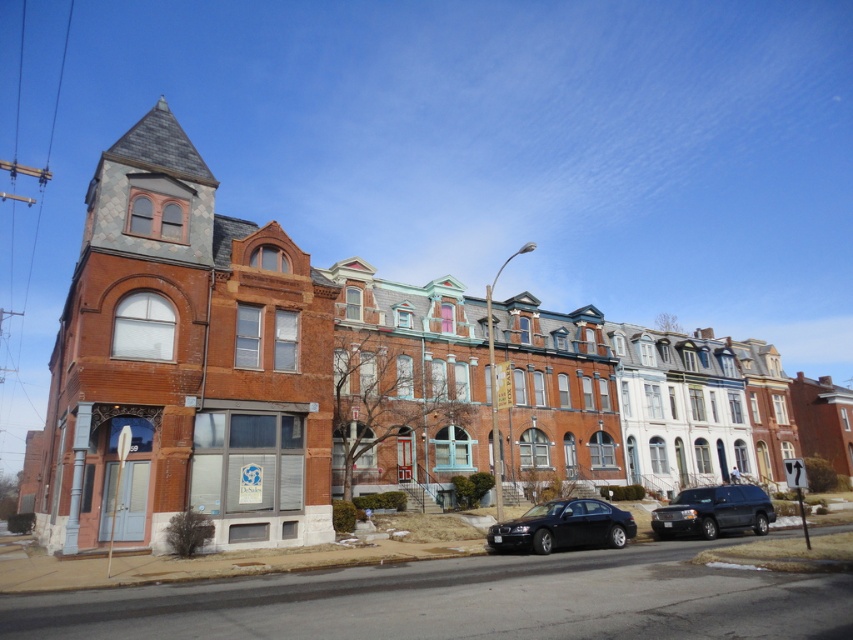
Question: Is shiny black sedan at center positioned in front of shiny black suv at lower right?

Choices:
 (A) yes
 (B) no

Answer: (A)

Question: Which point is farther from the camera taking this photo?

Choices:
 (A) (578, 532)
 (B) (708, 508)

Answer: (B)

Question: Is shiny black sedan at center positioned at the back of shiny black suv at lower right?

Choices:
 (A) no
 (B) yes

Answer: (A)

Question: Can you confirm if shiny black sedan at center is wider than shiny black suv at lower right?

Choices:
 (A) no
 (B) yes

Answer: (A)

Question: Which of the following is the closest to the observer?

Choices:
 (A) (701, 493)
 (B) (592, 513)

Answer: (B)